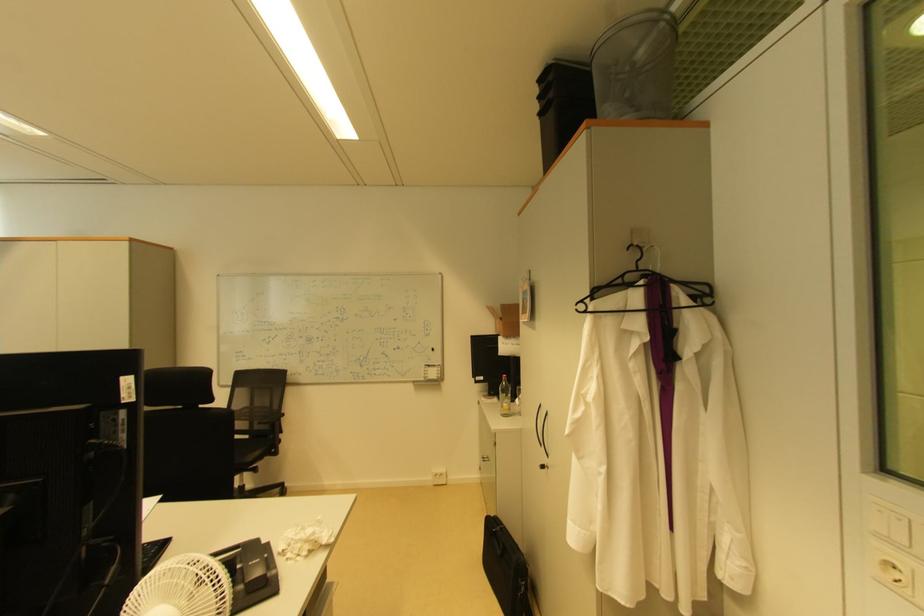
At what (x,y) coordinates should I click in order to perform the action: click on chair armrest. Please return your answer as a coordinate pair (x, y). The width and height of the screenshot is (924, 616). Looking at the image, I should click on (272, 416).